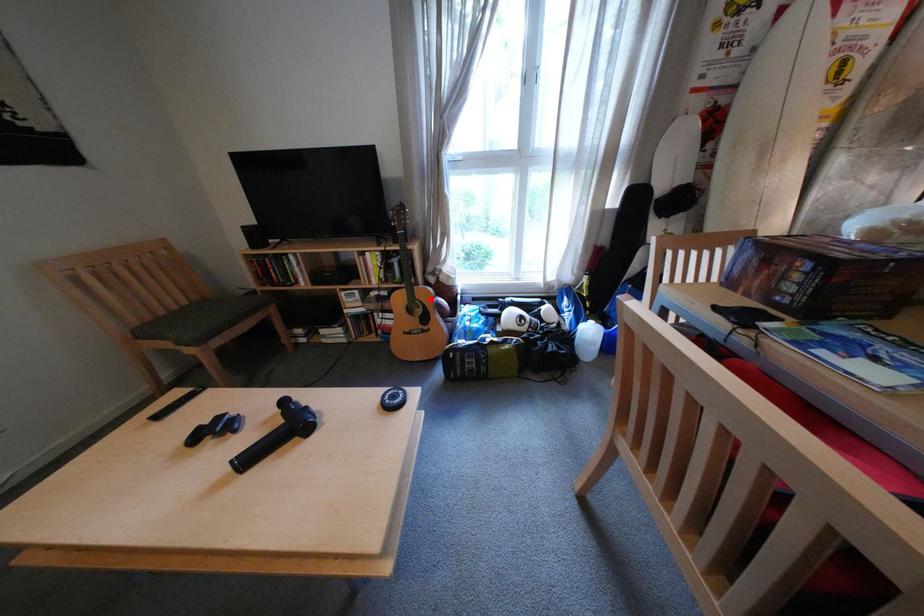
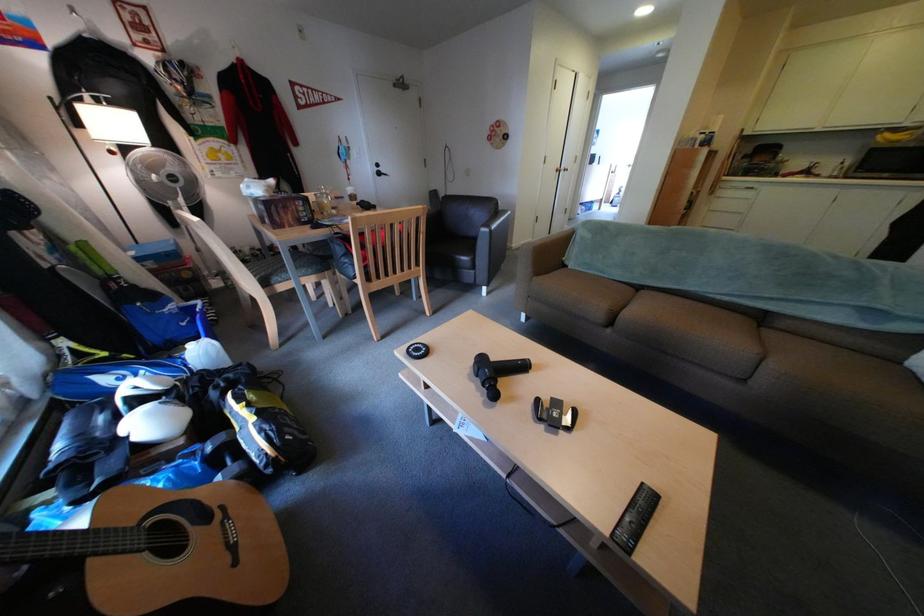
Locate, in the second image, the point that corresponds to the highlighted location in the first image.

(148, 527)